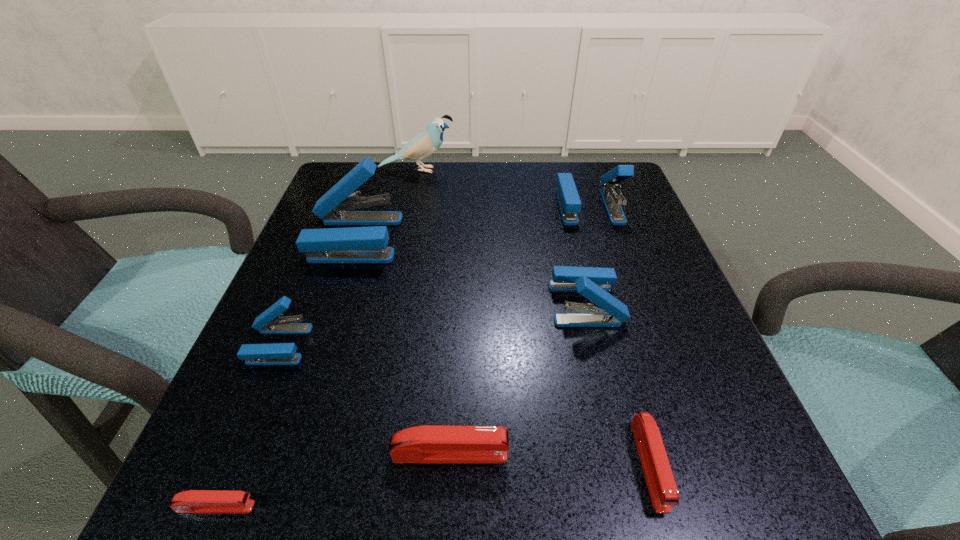
This screenshot has width=960, height=540. Identify the location of blank region between the smallest red stapler and the fourth tallest stapler. (248, 426).

In order to click on free spot between the second biggest red stapler and the second smallest blue stapler in this screenshot , I will do `click(617, 384)`.

I want to click on free point between the bird and the leftmost red stapler, so click(x=316, y=339).

You are a GUI agent. You are given a task and a screenshot of the screen. Output one action in this format:
    pyautogui.click(x=<x>, y=<y>)
    Task: Click on the object that ranks as the fourth closest to the bird
    This screenshot has width=960, height=540.
    Given the screenshot: What is the action you would take?
    pyautogui.click(x=269, y=322)

I want to click on object that is the fourth closest one to the biggest blue stapler, so click(569, 201).

Identify the location of stapler that is the sixth nearest to the rightmost red stapler. (354, 244).

Identify which stapler is the fifth closest to the biggest red stapler. Please provide its 2D coordinates. Your answer should be formatted as a tuple, i.e. [(x, y)], where the tuple contains the x and y coordinates of a point satisfying the conditions above.

[(354, 244)]

Identify which blue stapler is the closest to the bird. Please provide its 2D coordinates. Your answer should be formatted as a tuple, i.e. [(x, y)], where the tuple contains the x and y coordinates of a point satisfying the conditions above.

[(354, 244)]

Image resolution: width=960 pixels, height=540 pixels. I want to click on blue stapler that is the second nearest to the fourth stapler from left to right, so click(593, 283).

Locate an element on the screen. red stapler that is the second closest one to the blue bird is located at coordinates (662, 488).